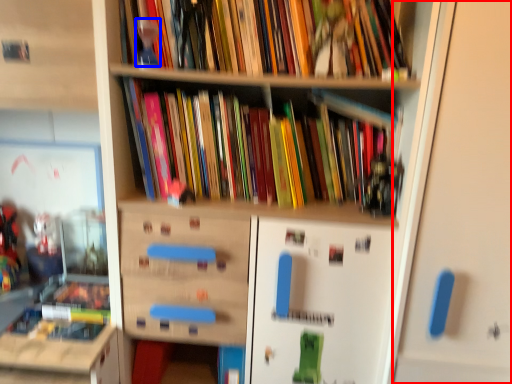
Question: Which object appears farthest to the camera in this image, door (highlighted by a red box) or toy (highlighted by a blue box)?

Choices:
 (A) door
 (B) toy

Answer: (B)